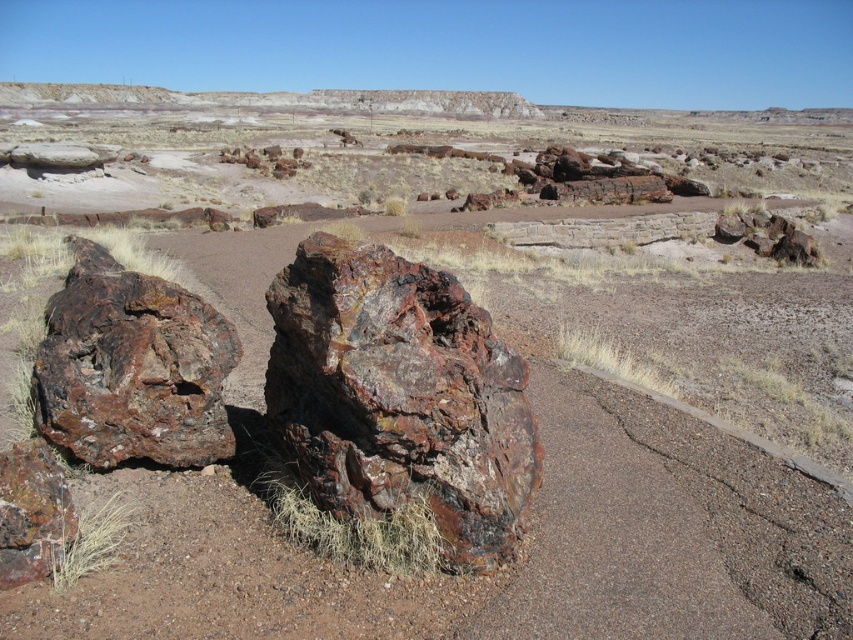
Question: Which point is farther from the camera taking this photo?

Choices:
 (A) (216, 458)
 (B) (299, 289)

Answer: (A)

Question: Is rusty stone boulder at center to the right of rusty wood log at left from the viewer's perspective?

Choices:
 (A) yes
 (B) no

Answer: (A)

Question: Can you confirm if rusty stone boulder at center is positioned below rusty wood log at left?

Choices:
 (A) yes
 (B) no

Answer: (A)

Question: Can you confirm if rusty stone boulder at center is positioned to the right of rusty wood log at left?

Choices:
 (A) yes
 (B) no

Answer: (A)

Question: Which object appears closest to the camera in this image?

Choices:
 (A) rusty wood log at left
 (B) rusty stone boulder at center

Answer: (B)

Question: Among these points, which one is farthest from the camera?

Choices:
 (A) (329, 496)
 (B) (33, 381)

Answer: (B)